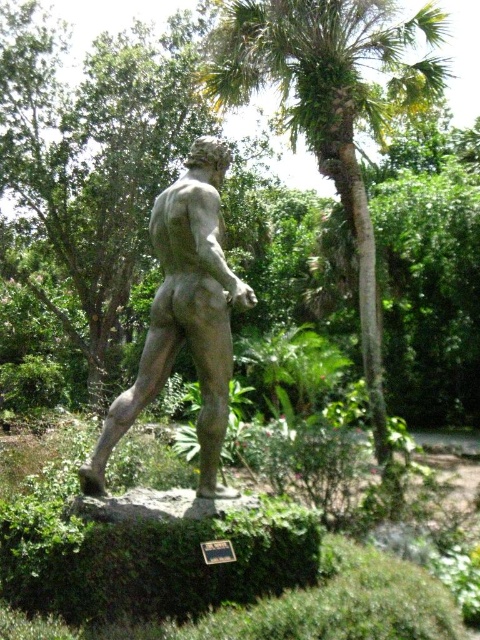
You are standing in front of the statue and want to know which of the two points, point (346, 204) or point (187, 211), is closer to you. Can you determine this based on their positions?

Point (346, 204) is further to the camera than point (187, 211), so the closer point to you is point (187, 211).

Looking at this image, you are an artist planning to paint a landscape that includes both the green leafy palm tree at center and the stone statue at center. Based on their sizes, which object should you depict as the taller one in your painting?

The stone statue at center is taller than the green leafy palm tree at center, so you should depict the stone statue at center as the taller one in your painting.